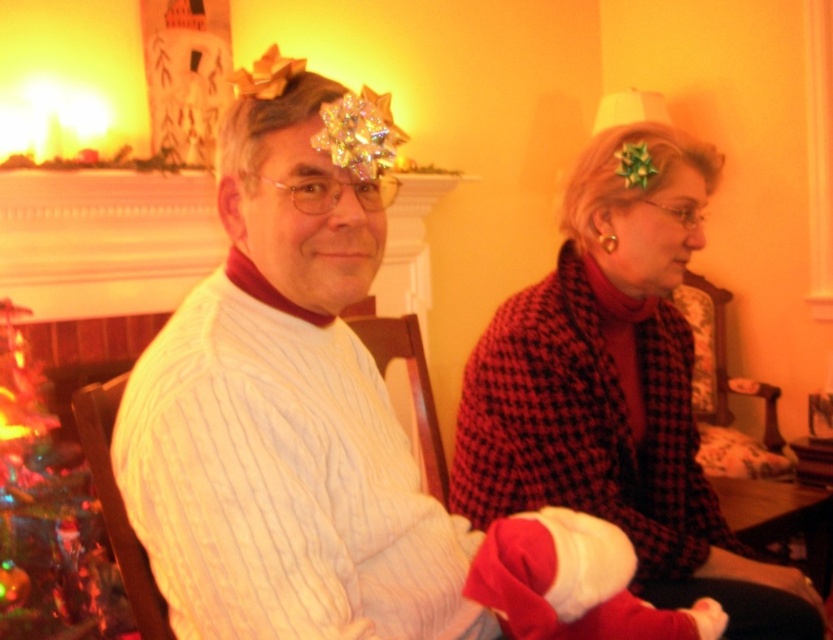
Can you confirm if red houndstooth shawl at center is taller than green artificial christmas tree at lower left?

No.

Which is below, red houndstooth shawl at center or green artificial christmas tree at lower left?

green artificial christmas tree at lower left is below.

Find the location of a particular element. This screenshot has width=833, height=640. red houndstooth shawl at center is located at coordinates (617, 388).

I want to click on red houndstooth shawl at center, so click(x=617, y=388).

Which is below, red houndstooth shawl at center or red velvet santa hat at lower center?

red velvet santa hat at lower center is below.

Is point (527, 289) positioned behind point (624, 611)?

Yes, point (527, 289) is farther from viewer.

Which is behind, point (602, 493) or point (554, 563)?

Point (602, 493)

Identify the location of red houndstooth shawl at center. pos(617,388).

Which is in front, point (63, 544) or point (711, 628)?

Point (711, 628)

Is green artificial christmas tree at lower left closer to camera compared to red velvet santa hat at lower center?

That is False.

Find the location of a particular element. green artificial christmas tree at lower left is located at coordinates (47, 515).